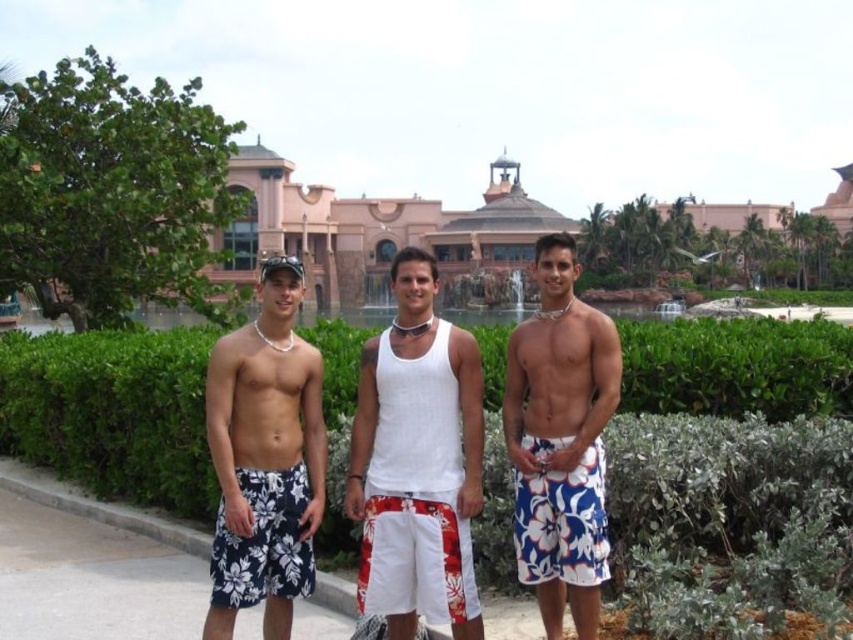
Question: Does white fabric tank top at center lie behind white floral shorts at center?

Choices:
 (A) no
 (B) yes

Answer: (B)

Question: Which of these objects is positioned closest to the white floral shorts at center?

Choices:
 (A) matte white shorts at center
 (B) white fabric tank top at center

Answer: (B)

Question: Which of the following is the farthest from the observer?

Choices:
 (A) matte white shorts at center
 (B) white floral shorts at center

Answer: (B)

Question: Which point is farther from the camera taking this photo?

Choices:
 (A) (405, 268)
 (B) (572, 589)

Answer: (A)

Question: Can you confirm if matte white shorts at center is positioned below white floral shorts at center?

Choices:
 (A) yes
 (B) no

Answer: (B)

Question: Does matte white shorts at center have a smaller size compared to white floral shorts at center?

Choices:
 (A) no
 (B) yes

Answer: (A)